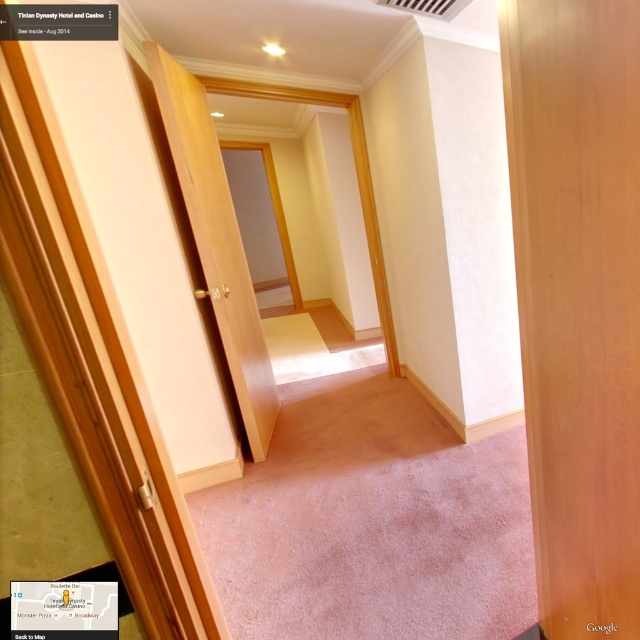
You are a hotel guest trying to find the room with the shorter door. You see two doors in the hallway labeled as light brown wood door at center and wooden door at center. Which door should you choose?

The light brown wood door at center has a lesser height compared to the wooden door at center, so you should choose the light brown wood door at center.

You are standing at point (188, 161) and want to walk to point (532, 20). Which direction should you move?

You should move forward because point (532, 20) is in front of point (188, 161).

You are standing in the hallway of the Tinian Dynasty Hotel and Casino. You see a light brown wood door at center and a wooden door at center. Which door is located to the right when facing the doors?

The light brown wood door at center is to the right of the wooden door at center.